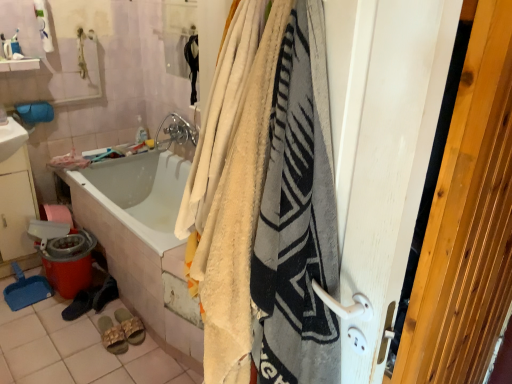
At what (x,y) coordinates should I click in order to perform the action: click on vacant area that lies between black fabric shoe at lower left, the 1th footwear from the left, and gold fabric slippers at lower center, acting as the 2th footwear starting from the right. Please return your answer as a coordinate pair (x, y). This screenshot has width=512, height=384. Looking at the image, I should click on (90, 327).